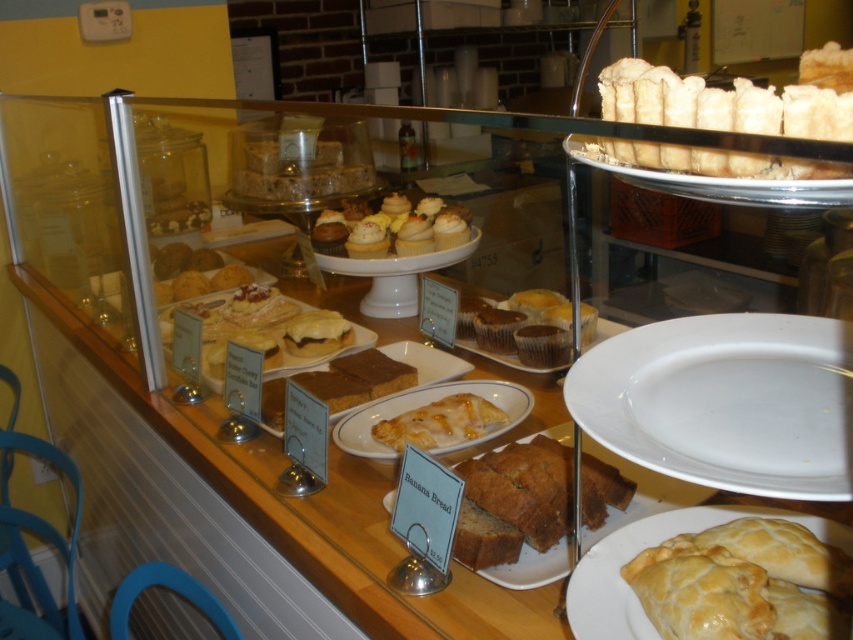
Can you confirm if matte brown cake at center is taller than matte white cupcakes at center?

Incorrect, matte brown cake at center's height is not larger of matte white cupcakes at center's.

What do you see at coordinates (361, 378) in the screenshot?
I see `matte brown cake at center` at bounding box center [361, 378].

Find the location of a particular element. The width and height of the screenshot is (853, 640). matte brown cake at center is located at coordinates (361, 378).

Locate an element on the screen. This screenshot has width=853, height=640. matte brown cake at center is located at coordinates (361, 378).

Between white ceramic plate at center and matte white cupcakes at center, which one appears on the left side from the viewer's perspective?

From the viewer's perspective, matte white cupcakes at center appears more on the left side.

Can you confirm if white ceramic plate at center is wider than matte white cupcakes at center?

Incorrect, white ceramic plate at center's width does not surpass matte white cupcakes at center's.

Measure the distance between white ceramic plate at center and camera.

The distance of white ceramic plate at center from camera is 16.66 inches.

Identify the location of white ceramic plate at center. (722, 403).

Is golden brown flaky pastry at center thinner than matte brown cake at center?

Yes.

The width and height of the screenshot is (853, 640). In order to click on golden brown flaky pastry at center in this screenshot , I will do coord(653,545).